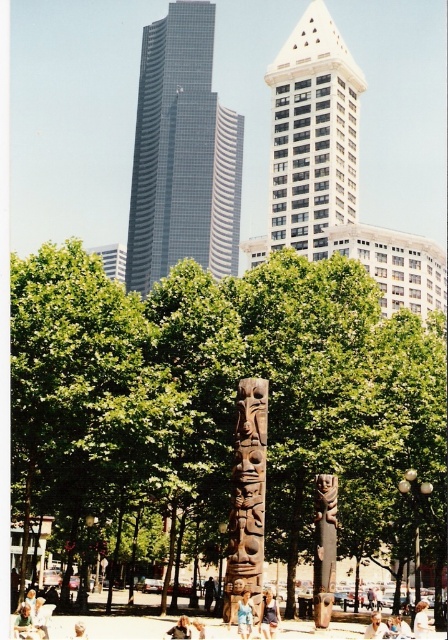
Question: Can you confirm if brown wooden totem pole at center is thinner than light brown wooden statue at lower center?

Choices:
 (A) yes
 (B) no

Answer: (A)

Question: Observing the image, what is the correct spatial positioning of white glass building at center in reference to denim shorts at center?

Choices:
 (A) left
 (B) right

Answer: (B)

Question: Among these objects, which one is nearest to the camera?

Choices:
 (A) light brown wooden chair at lower center
 (B) dark brown wood totem pole at center

Answer: (B)

Question: Which of the following is the closest to the observer?

Choices:
 (A) (327, 65)
 (B) (229, 570)

Answer: (B)

Question: Does light brown leather jacket at lower center lie behind light brown wooden statue at lower center?

Choices:
 (A) yes
 (B) no

Answer: (A)

Question: Which of the following is the closest to the observer?

Choices:
 (A) white glass building at center
 (B) white glass building at upper center
 (C) light brown leather jacket at lower center

Answer: (C)